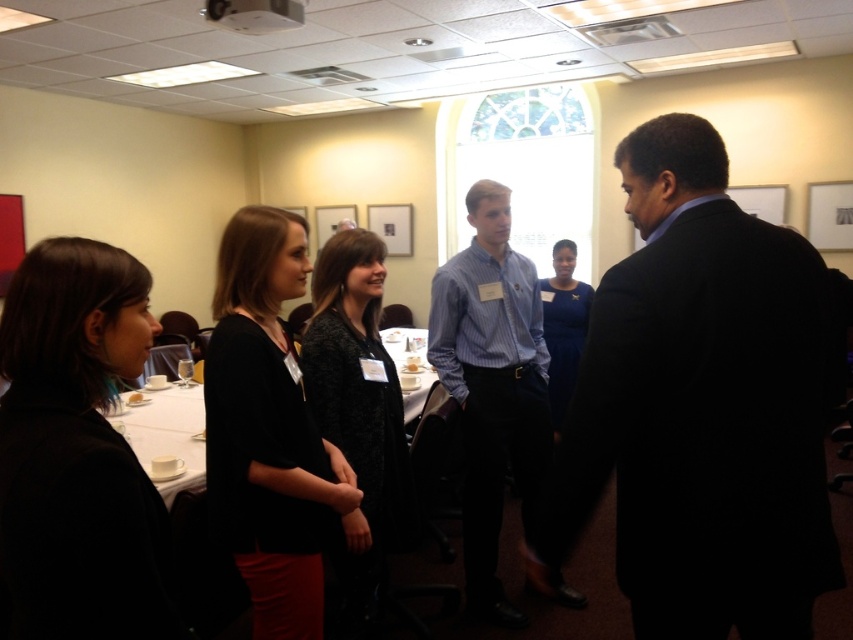
Question: From the image, what is the correct spatial relationship of dark suit at right in relation to black matte dress at center?

Choices:
 (A) below
 (B) above

Answer: (B)

Question: Is black matte jacket at lower left closer to camera compared to black textured sweater at center?

Choices:
 (A) no
 (B) yes

Answer: (B)

Question: Which object is closer to the camera taking this photo?

Choices:
 (A) blue satin dress at center
 (B) black textured sweater at center
 (C) blue striped shirt at center
 (D) black matte jacket at lower left

Answer: (D)

Question: Is the position of blue striped shirt at center less distant than that of black textured sweater at center?

Choices:
 (A) yes
 (B) no

Answer: (B)

Question: Which object is farther from the camera taking this photo?

Choices:
 (A) blue satin dress at center
 (B) black matte jacket at lower left

Answer: (A)

Question: Which point is closer to the camera?

Choices:
 (A) (263, 509)
 (B) (569, 307)
 (C) (44, 536)

Answer: (C)